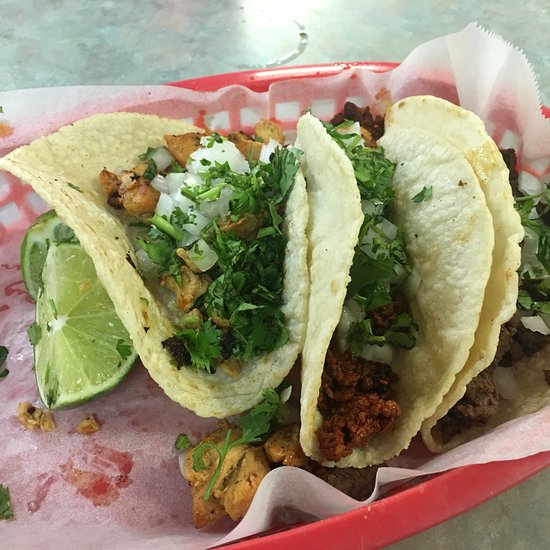
Where is `grey blue countertop`? grey blue countertop is located at coordinates (408, 26).